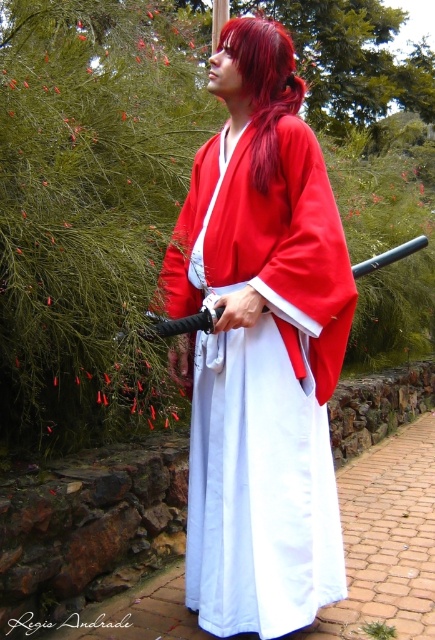
You are a photographer trying to capture the person in the scene. Since both the matte red kimono at center and the shiny red hair at center are red, which one would appear more reflective under a direct light source?

The shiny red hair at center would appear more reflective because it is described as shiny, while the matte red kimono at center has a non reflective surface.

You are a photographer setting up a shoot in a garden. You have two subjects in front of you, a matte red kimono at center and a shiny red hair at center. Which one is taller?

The matte red kimono at center is taller than the shiny red hair at center.